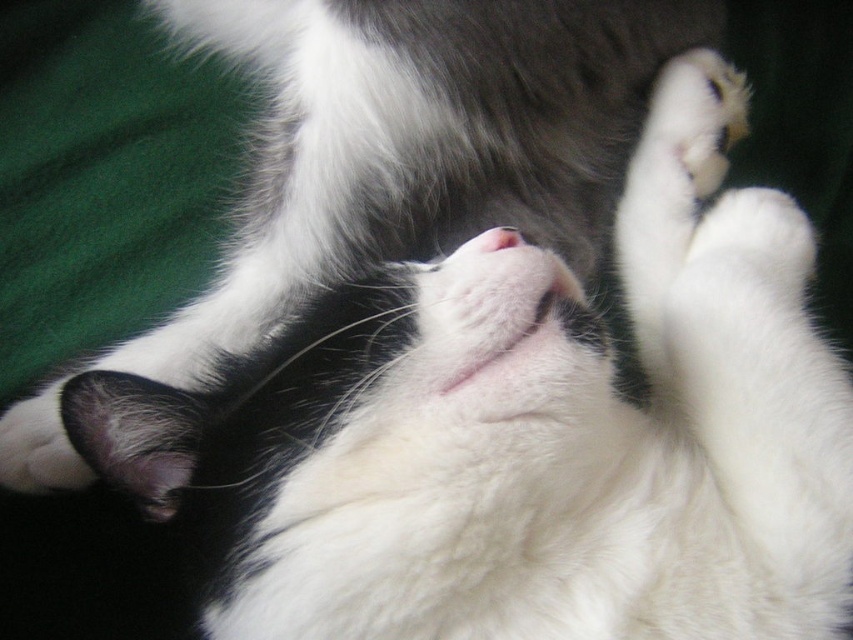
You are a photographer trying to capture the cat in the image. You notice the white fluffy cat at center and the pink fur at center. Which one is positioned higher in the image?

The white fluffy cat at center is above the pink fur at center, so it is positioned higher in the image.

You are an animal photographer trying to capture the cat in the image. You need to ensure the white fluffy cat at center and the pink fur at center are both visible in the frame. Based on their positions, which one should you focus on first to ensure both are in the shot?

The white fluffy cat at center is positioned on the left side of the pink fur at center. To ensure both are visible, focus on the pink fur at center first since it is on the right and the cat is on the left, allowing the photographer to frame from left to right.

Consider the image. You are a photographer adjusting your camera to capture the white fluffy cat at center. The camera has a focus point at coordinate point (415, 141). Will the cat be in focus?

Yes, the cat will be in focus because the focus point at point (415, 141) is exactly where the white fluffy cat at center is located.